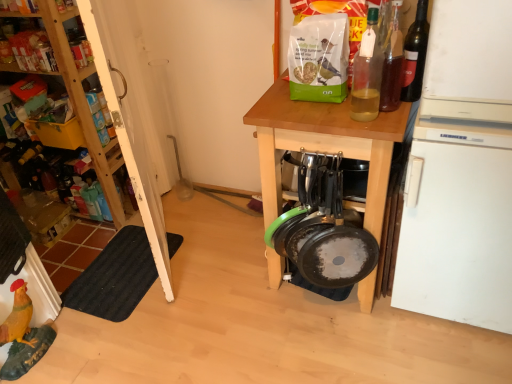
Question: Can you confirm if wooden table at center is bigger than wooden shelves at upper left?

Choices:
 (A) yes
 (B) no

Answer: (A)

Question: Could you tell me if wooden table at center is turned towards wooden shelves at upper left?

Choices:
 (A) yes
 (B) no

Answer: (B)

Question: From the image's perspective, is wooden table at center located above wooden shelves at upper left?

Choices:
 (A) yes
 (B) no

Answer: (B)

Question: Can you confirm if wooden table at center is thinner than wooden shelves at upper left?

Choices:
 (A) yes
 (B) no

Answer: (B)

Question: Is wooden shelves at upper left located within wooden table at center?

Choices:
 (A) yes
 (B) no

Answer: (B)

Question: Considering the positions of black rubber mat at lower left and white matte refrigerator at right in the image, is black rubber mat at lower left wider or thinner than white matte refrigerator at right?

Choices:
 (A) wide
 (B) thin

Answer: (B)

Question: Is black rubber mat at lower left taller or shorter than white matte refrigerator at right?

Choices:
 (A) short
 (B) tall

Answer: (A)

Question: In the image, is black rubber mat at lower left positioned in front of or behind white matte refrigerator at right?

Choices:
 (A) behind
 (B) front

Answer: (A)

Question: From the image's perspective, is black rubber mat at lower left positioned above or below white matte refrigerator at right?

Choices:
 (A) above
 (B) below

Answer: (B)

Question: In terms of width, does wooden table at center look wider or thinner when compared to translucent glass bottle at upper right, marked as the second bottle in a right-to-left arrangement?

Choices:
 (A) thin
 (B) wide

Answer: (B)

Question: Is wooden table at center inside or outside of translucent glass bottle at upper right, which is the second bottle in left-to-right order?

Choices:
 (A) outside
 (B) inside

Answer: (A)

Question: Looking at the image, does wooden table at center seem bigger or smaller compared to translucent glass bottle at upper right, marked as the second bottle in a right-to-left arrangement?

Choices:
 (A) small
 (B) big

Answer: (B)

Question: From their relative heights in the image, would you say wooden table at center is taller or shorter than translucent glass bottle at upper right, which is the second bottle in left-to-right order?

Choices:
 (A) short
 (B) tall

Answer: (B)

Question: Relative to translucent glass bottle at upper right, the 1th bottle viewed from the left, is wooden shelves at left in front or behind?

Choices:
 (A) behind
 (B) front

Answer: (A)

Question: From a real-world perspective, is wooden shelves at left above or below translucent glass bottle at upper right, the 3th bottle in the right-to-left sequence?

Choices:
 (A) above
 (B) below

Answer: (B)